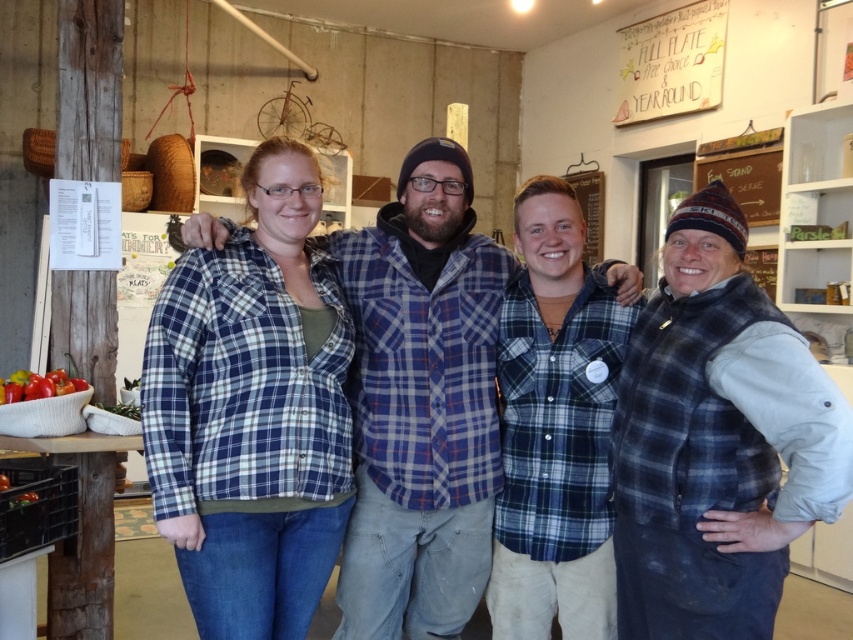
Is blue plaid shirt at center closer to camera compared to wooden signboard at upper right?

Yes, it is in front of wooden signboard at upper right.

Who is lower down, blue plaid shirt at center or wooden signboard at upper right?

blue plaid shirt at center is below.

This screenshot has width=853, height=640. I want to click on blue plaid shirt at center, so click(421, 403).

You are a GUI agent. You are given a task and a screenshot of the screen. Output one action in this format:
    pyautogui.click(x=<x>, y=<y>)
    Task: Click on the blue plaid shirt at center
    This screenshot has width=853, height=640.
    Given the screenshot: What is the action you would take?
    pyautogui.click(x=421, y=403)

Between wooden signboard at upper right and red glossy tomatoes at lower left, which one has less height?

red glossy tomatoes at lower left

Which is behind, point (599, 170) or point (16, 381)?

The point (599, 170) is behind.

Image resolution: width=853 pixels, height=640 pixels. What are the coordinates of `wooden signboard at upper right` in the screenshot? It's located at (590, 209).

Who is more forward, (460, 426) or (48, 396)?

Point (460, 426) is more forward.

The height and width of the screenshot is (640, 853). I want to click on blue plaid shirt at center, so click(421, 403).